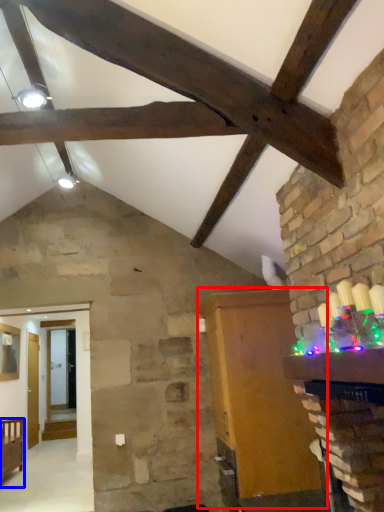
Question: Which object appears farthest to the camera in this image, furniture (highlighted by a red box) or furniture (highlighted by a blue box)?

Choices:
 (A) furniture
 (B) furniture

Answer: (B)